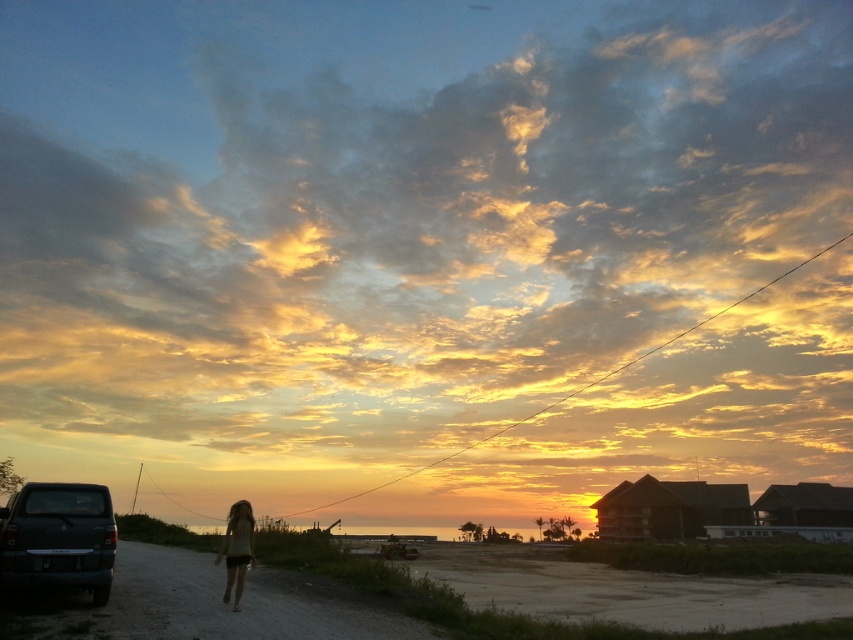
Between matte black truck at lower left and beige cotton shorts at lower left, which one has more height?

With more height is beige cotton shorts at lower left.

Between matte black truck at lower left and beige cotton shorts at lower left, which one has less height?

With less height is matte black truck at lower left.

This screenshot has width=853, height=640. Identify the location of matte black truck at lower left. (57, 538).